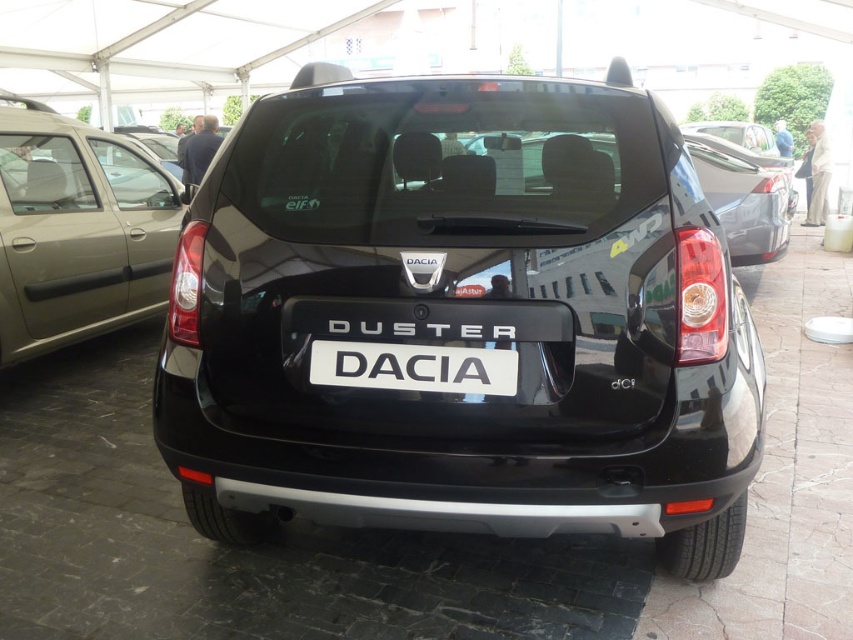
You are a photographer trying to capture the glossy black car at center without any obstructions. However, the white plastic license plate at center is blocking part of the car. Can you adjust your position to avoid the license plate while still keeping the car in the frame?

The glossy black car at center is positioned over the white plastic license plate at center, so moving the camera position slightly downward or to the side would allow capturing the car without the license plate obstruction while keeping it in frame.

You are standing in front of the Dacia Duster and notice a matte black minivan at left and a white plastic license plate at center. Which object is closer to you?

The matte black minivan at left is closer to you because it is further to the viewer than the white plastic license plate at center.

You are a photographer standing at the rear of the black Dacia Duster. You need to capture a photo that includes both the matte black minivan at left and the white plastic license plate at center. What is the minimum distance you should move backward to ensure both objects are in frame?

The matte black minivan at left is 3.04 meters from the white plastic license plate at center. To capture both in the frame, you should move back at least 3.04 meters to ensure both are visible.